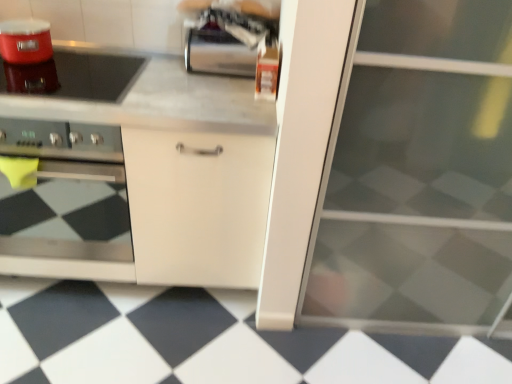
Where is `vacant space that is to the left of satin metallic paper towel holder at upper center`? Image resolution: width=512 pixels, height=384 pixels. vacant space that is to the left of satin metallic paper towel holder at upper center is located at coordinates (144, 69).